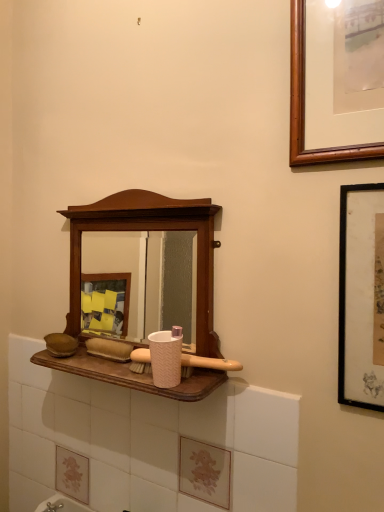
Question: Is pink textured brush at center bigger than wooden medicine cabinet at center?

Choices:
 (A) no
 (B) yes

Answer: (A)

Question: Is pink textured brush at center to the right of wooden medicine cabinet at center from the viewer's perspective?

Choices:
 (A) yes
 (B) no

Answer: (A)

Question: Is pink textured brush at center not inside wooden medicine cabinet at center?

Choices:
 (A) yes
 (B) no

Answer: (B)

Question: From the image's perspective, is pink textured brush at center over wooden medicine cabinet at center?

Choices:
 (A) no
 (B) yes

Answer: (A)

Question: Can you confirm if pink textured brush at center is shorter than wooden medicine cabinet at center?

Choices:
 (A) yes
 (B) no

Answer: (A)

Question: Do you think pink textured cup at center is within pink textured brush at center, or outside of it?

Choices:
 (A) outside
 (B) inside

Answer: (A)

Question: Considering the positions of pink textured cup at center and pink textured brush at center in the image, is pink textured cup at center wider or thinner than pink textured brush at center?

Choices:
 (A) thin
 (B) wide

Answer: (B)

Question: Is point (152, 358) closer or farther from the camera than point (130, 353)?

Choices:
 (A) closer
 (B) farther

Answer: (A)

Question: From a real-world perspective, relative to pink textured brush at center, is pink textured cup at center vertically above or below?

Choices:
 (A) above
 (B) below

Answer: (A)

Question: In terms of size, does wooden medicine cabinet at center appear bigger or smaller than pink textured brush at center?

Choices:
 (A) big
 (B) small

Answer: (A)

Question: In terms of height, does wooden medicine cabinet at center look taller or shorter compared to pink textured brush at center?

Choices:
 (A) tall
 (B) short

Answer: (A)

Question: Which is correct: wooden medicine cabinet at center is inside pink textured brush at center, or outside of it?

Choices:
 (A) inside
 (B) outside

Answer: (B)

Question: From the image's perspective, relative to pink textured brush at center, is wooden medicine cabinet at center above or below?

Choices:
 (A) above
 (B) below

Answer: (A)

Question: Is pink textured cup at center to the left or to the right of wooden medicine cabinet at center in the image?

Choices:
 (A) left
 (B) right

Answer: (B)

Question: Is pink textured cup at center bigger or smaller than wooden medicine cabinet at center?

Choices:
 (A) small
 (B) big

Answer: (A)